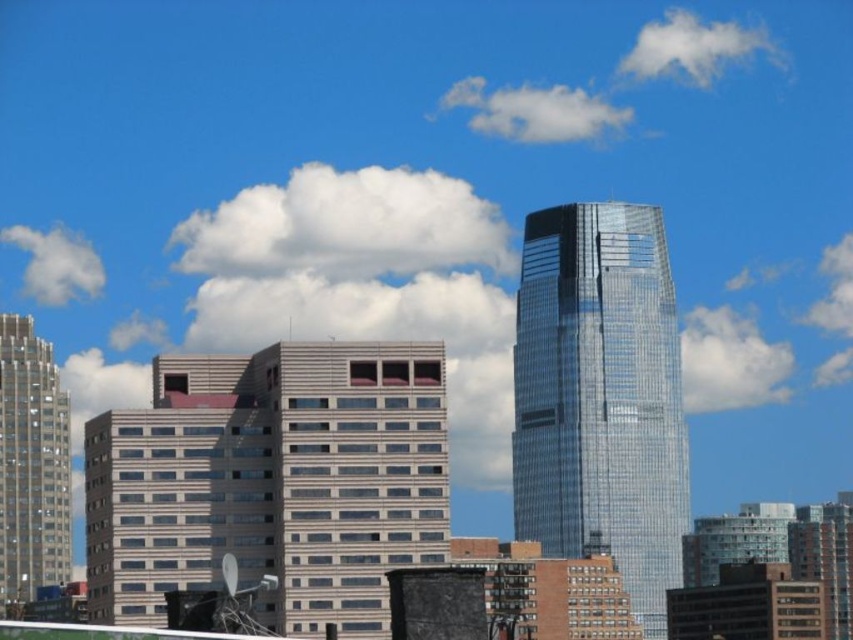
Does beige glass building at center have a greater width compared to matte glass skyscraper at left?

Yes.

From the picture: Does beige glass building at center have a larger size compared to matte glass skyscraper at left?

No.

Does point (262, 422) come farther from viewer compared to point (15, 436)?

No, it is not.

The height and width of the screenshot is (640, 853). Find the location of `beige glass building at center`. beige glass building at center is located at coordinates (271, 481).

Based on the photo, does glassy reflective skyscraper at center have a smaller size compared to matte glass skyscraper at left?

Actually, glassy reflective skyscraper at center might be larger than matte glass skyscraper at left.

Can you confirm if glassy reflective skyscraper at center is taller than matte glass skyscraper at left?

Correct, glassy reflective skyscraper at center is much taller as matte glass skyscraper at left.

Find the location of a particular element. The width and height of the screenshot is (853, 640). glassy reflective skyscraper at center is located at coordinates (601, 397).

Who is positioned more to the left, beige glass building at center or glassy reflective skyscraper at center?

Positioned to the left is beige glass building at center.

Is beige glass building at center above glassy reflective skyscraper at center?

Yes.

Is point (357, 429) in front of point (548, 484)?

Yes, point (357, 429) is closer to viewer.

Where is `beige glass building at center`? beige glass building at center is located at coordinates (271, 481).